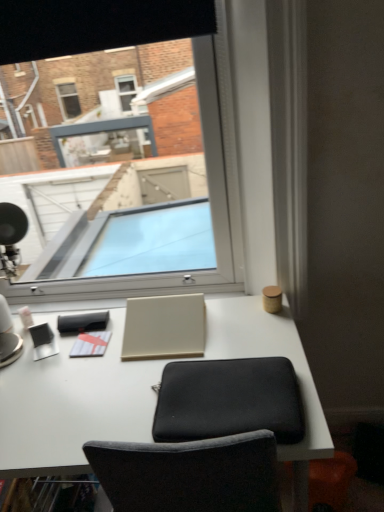
At what (x,y) coordinates should I click in order to perform the action: click on vacant space situated above black fabric computer chair at center (from a real-world perspective). Please return your answer as a coordinate pair (x, y). The image size is (384, 512). Looking at the image, I should click on (224, 388).